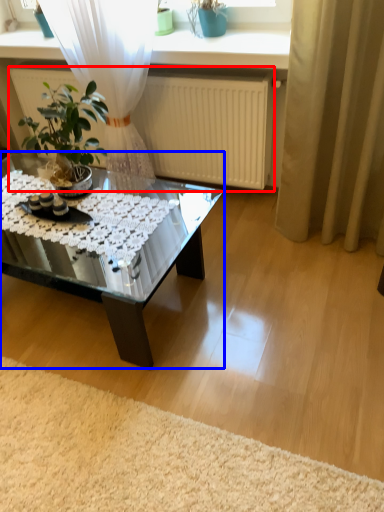
Question: Among these objects, which one is farthest to the camera, radiator (highlighted by a red box) or coffee table (highlighted by a blue box)?

Choices:
 (A) radiator
 (B) coffee table

Answer: (A)